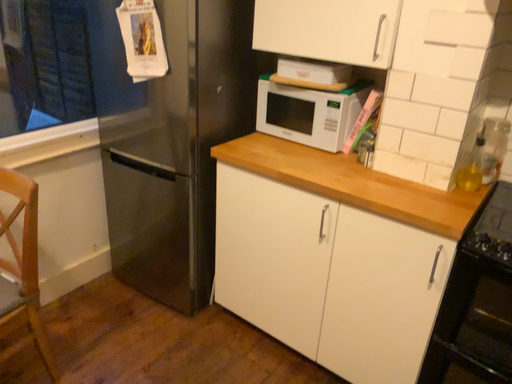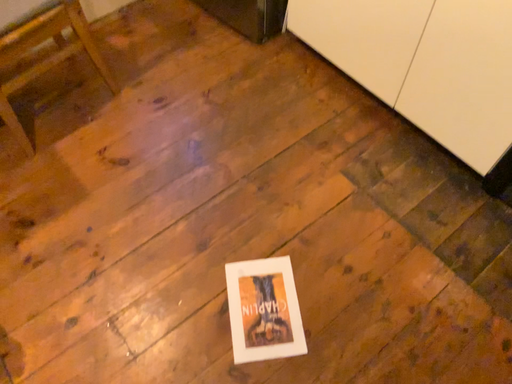
Question: Which way did the camera rotate in the video?

Choices:
 (A) rotated right
 (B) rotated left

Answer: (B)